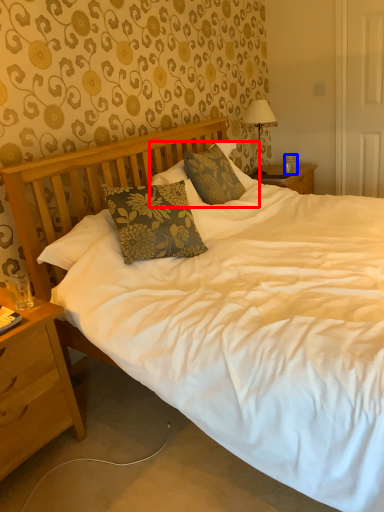
Question: Which object is closer to the camera taking this photo, pillow (highlighted by a red box) or coffee cup (highlighted by a blue box)?

Choices:
 (A) pillow
 (B) coffee cup

Answer: (A)